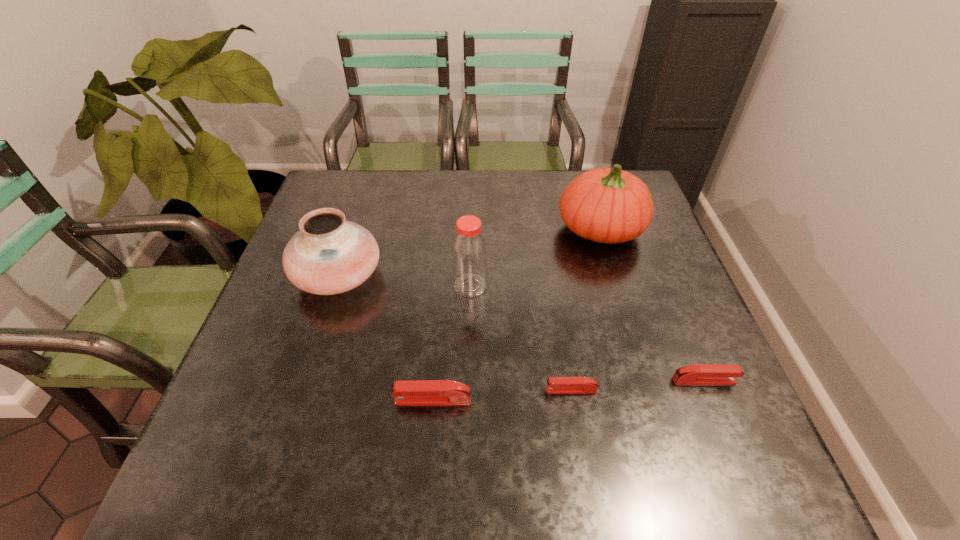
This screenshot has width=960, height=540. Find the location of `vacant region between the nearest object and the second nearest object`. vacant region between the nearest object and the second nearest object is located at coordinates (502, 395).

Where is `free spot between the third nearest object and the bottle`? Image resolution: width=960 pixels, height=540 pixels. free spot between the third nearest object and the bottle is located at coordinates (588, 333).

Image resolution: width=960 pixels, height=540 pixels. I want to click on vacant area that lies between the pumpkin and the nearest object, so click(516, 314).

Where is `vacant point located between the pumpkin and the tallest stapler`? The width and height of the screenshot is (960, 540). vacant point located between the pumpkin and the tallest stapler is located at coordinates (516, 314).

Image resolution: width=960 pixels, height=540 pixels. Identify the location of vacant area that lies between the fourth tallest object and the second stapler from right to left. (502, 395).

Where is `free space that is in between the shortest object and the nearest object`? This screenshot has width=960, height=540. free space that is in between the shortest object and the nearest object is located at coordinates (502, 395).

Locate an element on the screen. This screenshot has height=540, width=960. the fifth closest object to the pottery is located at coordinates (698, 374).

Identify which object is located as the fourth nearest to the pumpkin. Please provide its 2D coordinates. Your answer should be formatted as a tuple, i.e. [(x, y)], where the tuple contains the x and y coordinates of a point satisfying the conditions above.

[(328, 255)]

Locate an element on the screen. Image resolution: width=960 pixels, height=540 pixels. stapler identified as the closest to the nearest object is located at coordinates (555, 385).

Select which stapler is the closest to the second nearest object. Please provide its 2D coordinates. Your answer should be formatted as a tuple, i.e. [(x, y)], where the tuple contains the x and y coordinates of a point satisfying the conditions above.

[(410, 392)]